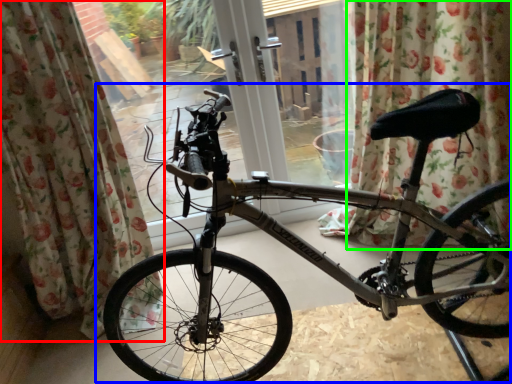
Question: Based on their relative distances, which object is nearer to curtain (highlighted by a red box)? Choose from bicycle (highlighted by a blue box) and curtain (highlighted by a green box).

Choices:
 (A) bicycle
 (B) curtain

Answer: (A)